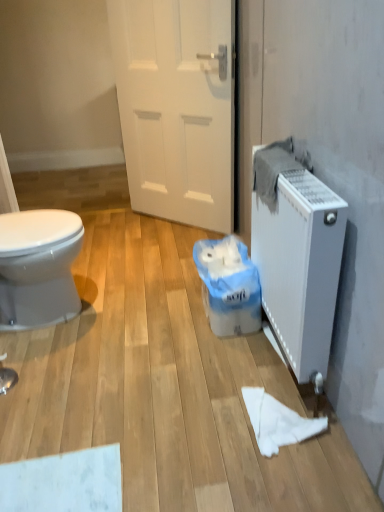
Locate an element on the screen. vacant space situated on the left part of white plastic bag at center is located at coordinates (158, 317).